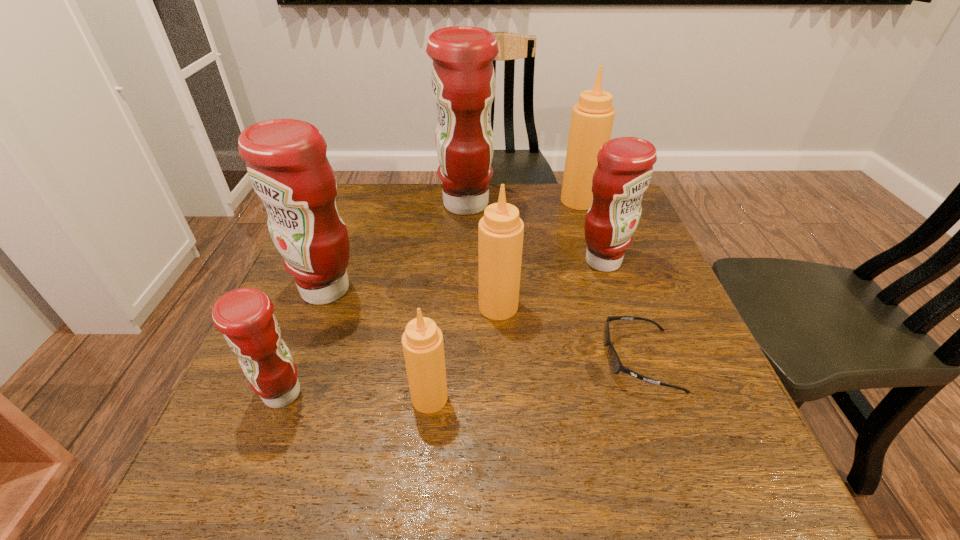
The height and width of the screenshot is (540, 960). I want to click on vacant region between the smallest tan condiment and the rightmost red condiment, so click(x=516, y=329).

Where is `free space between the leftmost tan condiment and the third smallest red condiment`? The width and height of the screenshot is (960, 540). free space between the leftmost tan condiment and the third smallest red condiment is located at coordinates (377, 344).

This screenshot has height=540, width=960. I want to click on free point between the gray sunglasses and the leftmost tan condiment, so coord(535,379).

Where is `free area in between the sunglasses and the biggest red condiment`? free area in between the sunglasses and the biggest red condiment is located at coordinates (553, 282).

What are the coordinates of `vacant area that lies between the farthest tan condiment and the second smallest tan condiment` in the screenshot? It's located at (539, 253).

You are a GUI agent. You are given a task and a screenshot of the screen. Output one action in this format:
    pyautogui.click(x=<x>, y=<y>)
    Task: Click on the unoccupied position between the farthest red condiment and the second smallest red condiment
    
    Given the screenshot: What is the action you would take?
    pyautogui.click(x=535, y=233)

Image resolution: width=960 pixels, height=540 pixels. What are the coordinates of `object that ranks as the fifth closest to the tallest object` in the screenshot? It's located at (615, 363).

Find the location of `the third closest object to the rightmost tan condiment`. the third closest object to the rightmost tan condiment is located at coordinates (500, 231).

At what (x,y) coordinates should I click in order to perform the action: click on condiment that is the closest to the nearest red condiment. Please return your answer as a coordinate pair (x, y). This screenshot has width=960, height=540. Looking at the image, I should click on (286, 161).

This screenshot has width=960, height=540. What are the coordinates of `condiment identified as the fourth closest to the rightmost red condiment` in the screenshot? It's located at (422, 341).